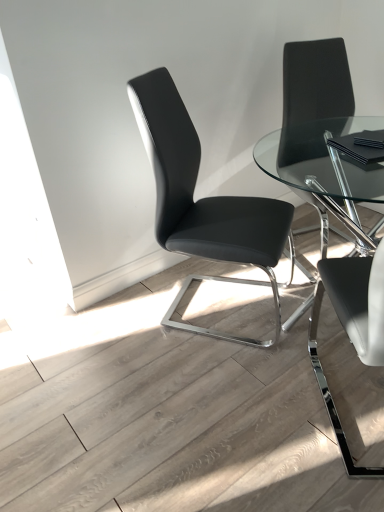
I want to click on free spot below black leather chair at center, which ranks as the 1th chair in left-to-right order (from a real-world perspective), so pyautogui.click(x=203, y=305).